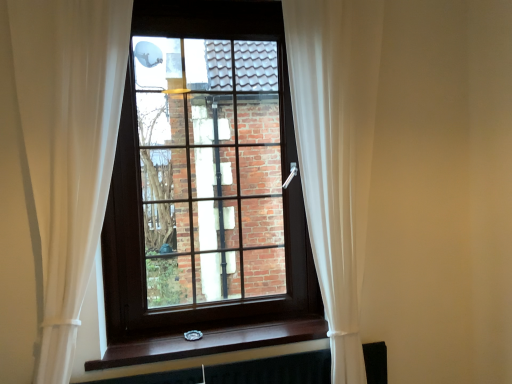
Question: Is point (99, 155) positioned closer to the camera than point (151, 314)?

Choices:
 (A) farther
 (B) closer

Answer: (B)

Question: Would you say white sheer curtain at center, which ranks as the second curtain in right-to-left order, is inside or outside brown wooden window at center?

Choices:
 (A) outside
 (B) inside

Answer: (A)

Question: Based on their relative distances, which object is nearer to the brown wood at lower center?

Choices:
 (A) white sheer curtain at right, the second curtain positioned from the left
 (B) white sheer curtain at center, acting as the first curtain starting from the left
 (C) black matte radiator at bottom
 (D) brown wooden window at center

Answer: (C)

Question: Estimate the real-world distances between objects in this image. Which object is farther from the brown wooden window at center?

Choices:
 (A) black matte radiator at bottom
 (B) white sheer curtain at right, the second curtain positioned from the left
 (C) brown wood at lower center
 (D) white sheer curtain at center, acting as the first curtain starting from the left

Answer: (A)